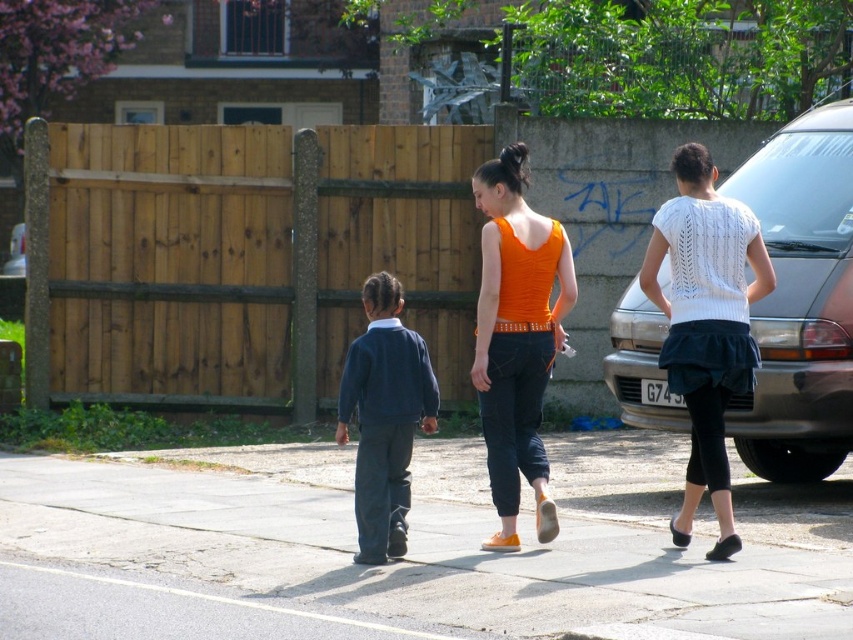
Is point (647, 358) positioned after point (683, 266)?

Yes, point (647, 358) is farther from viewer.

Is point (799, 481) positioned before point (688, 380)?

No, it is not.

Locate an element on the screen. metallic gray car at right is located at coordinates (799, 300).

Does point (825, 520) come behind point (682, 246)?

Yes, it is behind point (682, 246).

Measure the distance between gray concrete sidewalk at center and white knitted sweater at upper right.

gray concrete sidewalk at center and white knitted sweater at upper right are 5.86 feet apart from each other.

Is point (97, 476) farther from camera compared to point (718, 250)?

Yes, point (97, 476) is farther from viewer.

What are the coordinates of `gray concrete sidewalk at center` in the screenshot? It's located at (409, 550).

Does gray concrete sidewalk at center appear on the left side of navy blue sweater at center?

No, gray concrete sidewalk at center is not to the left of navy blue sweater at center.

Is point (822, 605) positioned in front of point (364, 416)?

Yes, point (822, 605) is closer to viewer.

What are the coordinates of `gray concrete sidewalk at center` in the screenshot? It's located at (409, 550).